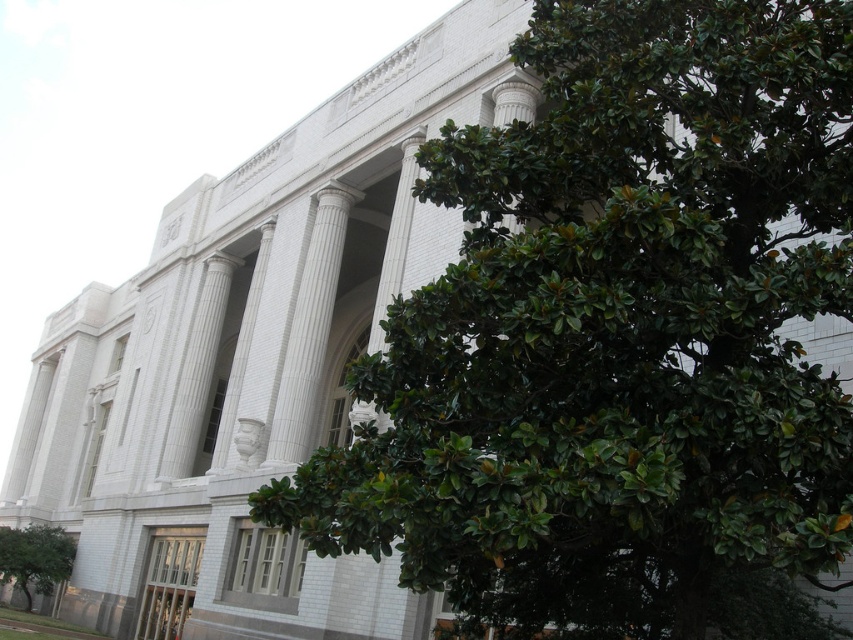
Does green leafy tree at center have a lesser height compared to green leafy tree at lower left?

In fact, green leafy tree at center may be taller than green leafy tree at lower left.

Consider the image. Which of these two, green leafy tree at center or green leafy tree at lower left, stands taller?

With more height is green leafy tree at center.

Which is in front, point (778, 269) or point (64, 573)?

Point (778, 269) is in front.

I want to click on green leafy tree at center, so click(616, 332).